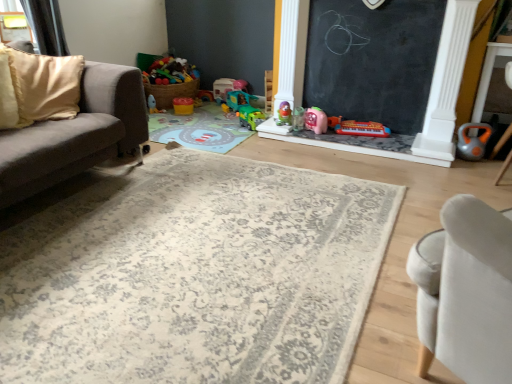
This screenshot has width=512, height=384. Find the location of `unoccupied area in front of green plastic toy car at center, which is the 6th toy from right to left`. unoccupied area in front of green plastic toy car at center, which is the 6th toy from right to left is located at coordinates 240,131.